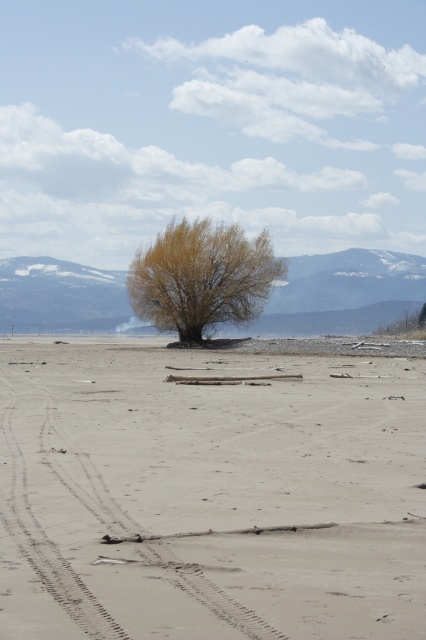
Question: Does brown sandy dirt field at center have a larger size compared to yellow-green leafy tree at center?

Choices:
 (A) yes
 (B) no

Answer: (B)

Question: From the image, what is the correct spatial relationship of brown sandy dirt field at center in relation to yellow-green leafy tree at center?

Choices:
 (A) left
 (B) right

Answer: (B)

Question: Among these objects, which one is farthest from the camera?

Choices:
 (A) yellow-green leafy tree at center
 (B) brown sandy dirt field at center

Answer: (A)

Question: Is brown sandy dirt field at center to the right of yellow-green leafy tree at center from the viewer's perspective?

Choices:
 (A) yes
 (B) no

Answer: (A)